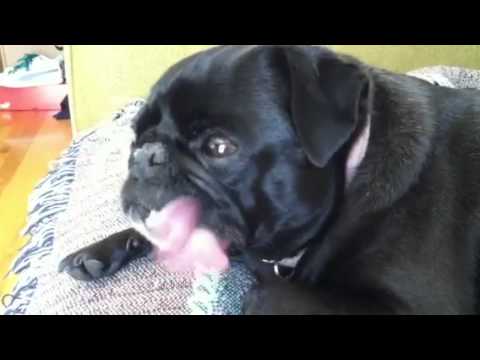
At what (x,y) coordinates should I click in order to perform the action: click on floor. Please return your answer as a coordinate pair (x, y). The image size is (480, 360). Looking at the image, I should click on (15, 182).